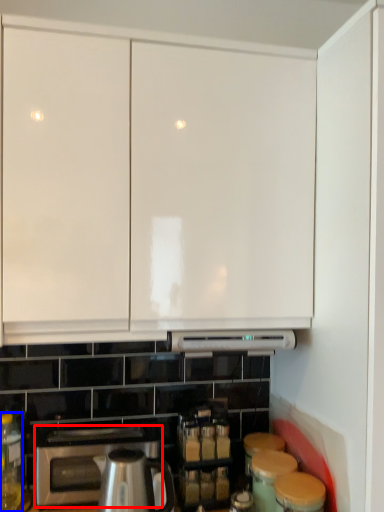
Question: Which object appears farthest to the camera in this image, home appliance (highlighted by a red box) or bottle (highlighted by a blue box)?

Choices:
 (A) home appliance
 (B) bottle

Answer: (A)